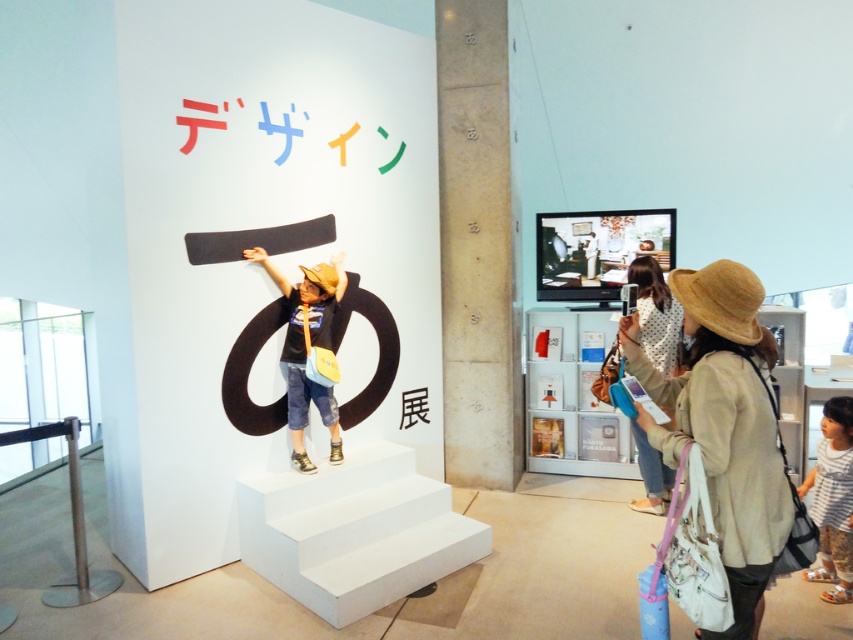
Does beige straw hat at right have a greater width compared to denim shorts at center?

In fact, beige straw hat at right might be narrower than denim shorts at center.

Which is more to the right, beige straw hat at right or denim shorts at center?

beige straw hat at right is more to the right.

Which is behind, point (682, 272) or point (322, 394)?

Point (322, 394)

Image resolution: width=853 pixels, height=640 pixels. Identify the location of beige straw hat at right. (724, 424).

Who is taller, beige straw hat at right or light brown straw hat at center?

Standing taller between the two is beige straw hat at right.

In the scene shown: Is beige straw hat at right below light brown straw hat at center?

Yes, beige straw hat at right is below light brown straw hat at center.

I want to click on beige straw hat at right, so click(724, 424).

Locate an element on the screen. The width and height of the screenshot is (853, 640). beige straw hat at right is located at coordinates (724, 424).

What do you see at coordinates (306, 348) in the screenshot?
I see `denim shorts at center` at bounding box center [306, 348].

Where is `denim shorts at center`? denim shorts at center is located at coordinates (306, 348).